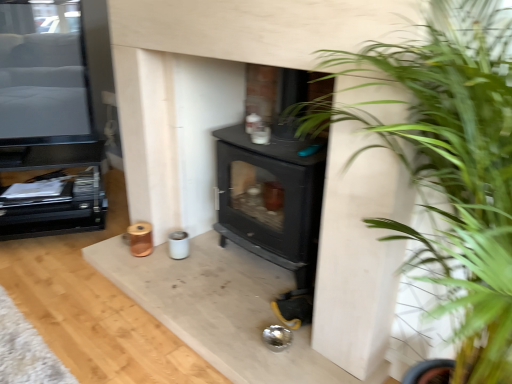
Question: Is black matte entertainment center at left, marked as the first entertainment center in a bottom-to-top arrangement, wider than black glossy tv at upper left, placed as the 1th entertainment center when sorted from top to bottom?

Choices:
 (A) yes
 (B) no

Answer: (A)

Question: Can you confirm if black matte entertainment center at left, which is counted as the second entertainment center, starting from the top, is bigger than black glossy tv at upper left, positioned as the 2th entertainment center in bottom-to-top order?

Choices:
 (A) yes
 (B) no

Answer: (A)

Question: Is black matte entertainment center at left, marked as the first entertainment center in a bottom-to-top arrangement, positioned before black glossy tv at upper left, placed as the 1th entertainment center when sorted from top to bottom?

Choices:
 (A) no
 (B) yes

Answer: (A)

Question: Is black matte entertainment center at left, which is counted as the second entertainment center, starting from the top, positioned behind black glossy tv at upper left, positioned as the 2th entertainment center in bottom-to-top order?

Choices:
 (A) no
 (B) yes

Answer: (B)

Question: From a real-world perspective, is black matte entertainment center at left, marked as the first entertainment center in a bottom-to-top arrangement, over black glossy tv at upper left, placed as the 1th entertainment center when sorted from top to bottom?

Choices:
 (A) no
 (B) yes

Answer: (A)

Question: Is black matte entertainment center at left, marked as the first entertainment center in a bottom-to-top arrangement, to the left of black glossy tv at upper left, placed as the 1th entertainment center when sorted from top to bottom, from the viewer's perspective?

Choices:
 (A) yes
 (B) no

Answer: (A)

Question: From a real-world perspective, is black glossy tv at upper left, placed as the 1th entertainment center when sorted from top to bottom, located higher than black matte entertainment center at left, which is counted as the second entertainment center, starting from the top?

Choices:
 (A) yes
 (B) no

Answer: (A)

Question: Is the depth of black glossy tv at upper left, placed as the 1th entertainment center when sorted from top to bottom, less than that of black matte entertainment center at left, marked as the first entertainment center in a bottom-to-top arrangement?

Choices:
 (A) no
 (B) yes

Answer: (B)

Question: From the image's perspective, is black glossy tv at upper left, placed as the 1th entertainment center when sorted from top to bottom, on black matte entertainment center at left, which is counted as the second entertainment center, starting from the top?

Choices:
 (A) no
 (B) yes

Answer: (B)

Question: Is black glossy tv at upper left, positioned as the 2th entertainment center in bottom-to-top order, smaller than black matte entertainment center at left, marked as the first entertainment center in a bottom-to-top arrangement?

Choices:
 (A) yes
 (B) no

Answer: (A)

Question: Does black glossy tv at upper left, positioned as the 2th entertainment center in bottom-to-top order, have a larger size compared to black matte entertainment center at left, marked as the first entertainment center in a bottom-to-top arrangement?

Choices:
 (A) no
 (B) yes

Answer: (A)

Question: Would you say black glossy tv at upper left, placed as the 1th entertainment center when sorted from top to bottom, contains black matte entertainment center at left, marked as the first entertainment center in a bottom-to-top arrangement?

Choices:
 (A) yes
 (B) no

Answer: (B)

Question: Considering the relative sizes of black glossy tv at upper left, placed as the 1th entertainment center when sorted from top to bottom, and green leafy plant at center right in the image provided, is black glossy tv at upper left, placed as the 1th entertainment center when sorted from top to bottom, thinner than green leafy plant at center right?

Choices:
 (A) yes
 (B) no

Answer: (A)